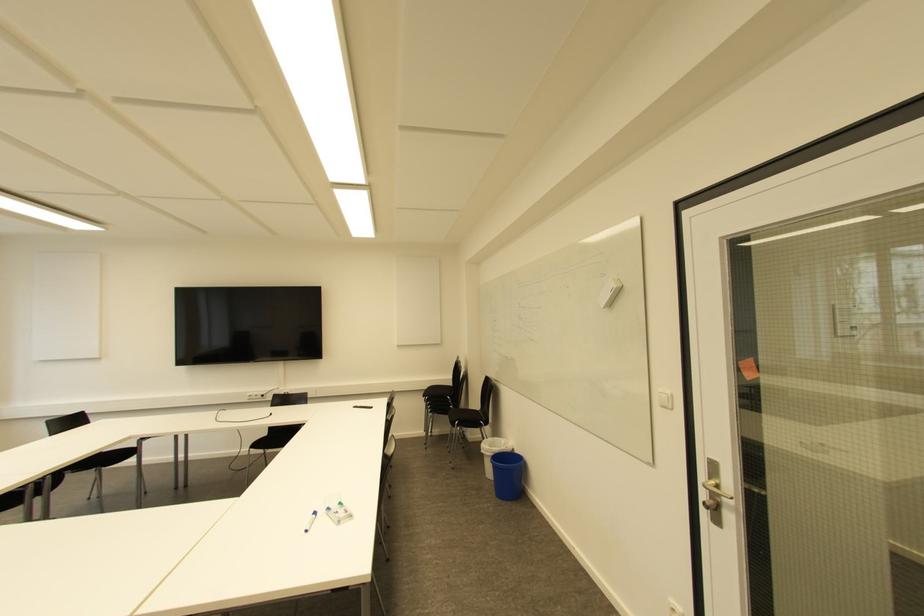
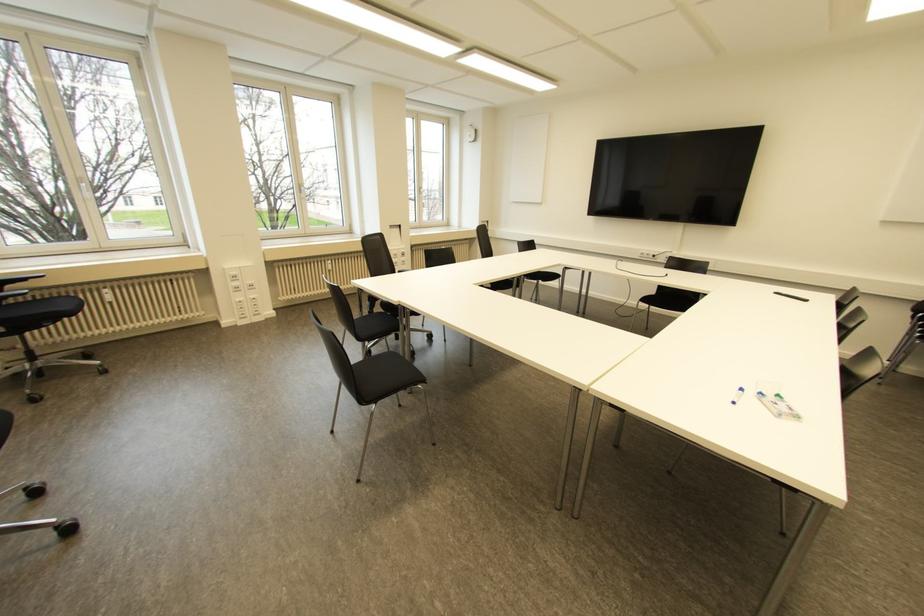
In the second image, find the point that corresponds to (313,514) in the first image.

(739, 390)